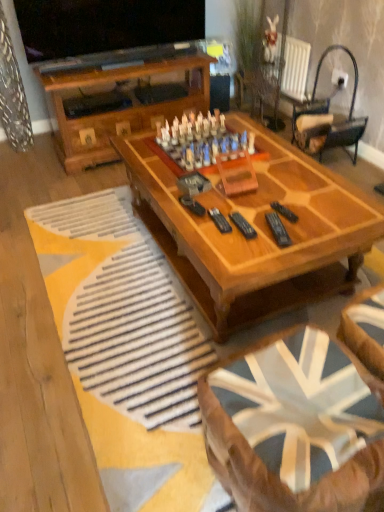
Question: Considering the positions of black plastic remote at center, which appears as the third remote when viewed from the right, and black metal/wooden rocking chair at upper right in the image, is black plastic remote at center, which appears as the third remote when viewed from the right, wider or thinner than black metal/wooden rocking chair at upper right?

Choices:
 (A) wide
 (B) thin

Answer: (B)

Question: In terms of size, does black plastic remote at center, marked as the 1th remote in a left-to-right arrangement, appear bigger or smaller than black metal/wooden rocking chair at upper right?

Choices:
 (A) small
 (B) big

Answer: (A)

Question: Which object is the farthest from the black plastic remote at center, marked as the 1th remote in a left-to-right arrangement?

Choices:
 (A) black plastic remote at center, positioned as the first remote in right-to-left order
 (B) black plastic remote at center, which is the 2th remote in left-to-right order
 (C) black metal/wooden rocking chair at upper right
 (D) wooden chess set at center
 (E) wooden coffee table at center, which is counted as the 1th coffee table, starting from the back

Answer: (C)

Question: Based on their relative distances, which object is nearer to the black plastic remote at center, positioned as the first remote in right-to-left order?

Choices:
 (A) wooden chess set at center
 (B) black plastic remote at center, arranged as the second remote when viewed from the right
 (C) black metal/wooden rocking chair at upper right
 (D) wooden coffee table at center, which is counted as the 1th coffee table, starting from the back
 (E) wooden coffee table at center, which is the first coffee table from front to back

Answer: (B)